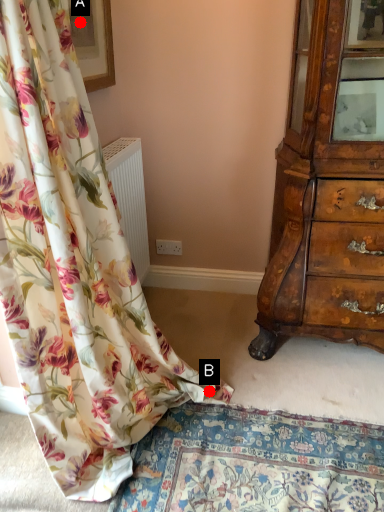
Question: Two points are circled on the image, labeled by A and B beside each circle. Among these points, which one is nearest to the camera?

Choices:
 (A) A is closer
 (B) B is closer

Answer: (B)